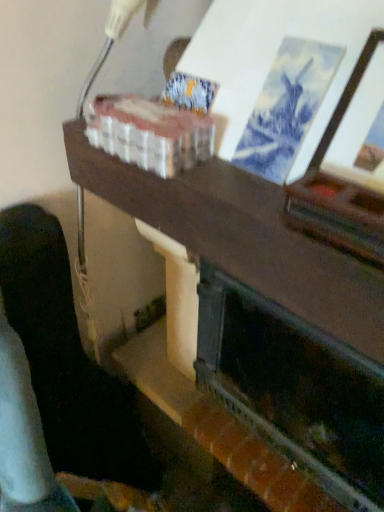
Question: Is the surface of dark wood shelf at lower left in direct contact with dark green painted wood fireplace at center?

Choices:
 (A) no
 (B) yes

Answer: (A)

Question: From a real-world perspective, is dark wood shelf at lower left on dark green painted wood fireplace at center?

Choices:
 (A) no
 (B) yes

Answer: (A)

Question: Can we say dark wood shelf at lower left lies outside dark green painted wood fireplace at center?

Choices:
 (A) no
 (B) yes

Answer: (B)

Question: Does dark wood shelf at lower left contain dark green painted wood fireplace at center?

Choices:
 (A) yes
 (B) no

Answer: (B)

Question: Is dark wood shelf at lower left shorter than dark green painted wood fireplace at center?

Choices:
 (A) yes
 (B) no

Answer: (B)

Question: Is dark green painted wood fireplace at center spatially inside dark wood table at center, or outside of it?

Choices:
 (A) inside
 (B) outside

Answer: (A)

Question: Is point (208, 373) positioned closer to the camera than point (283, 346)?

Choices:
 (A) farther
 (B) closer

Answer: (A)

Question: In the image, is dark green painted wood fireplace at center positioned in front of or behind dark wood table at center?

Choices:
 (A) front
 (B) behind

Answer: (B)

Question: From a real-world perspective, is dark green painted wood fireplace at center positioned above or below dark wood table at center?

Choices:
 (A) above
 (B) below

Answer: (B)

Question: Considering the positions of point (16, 306) and point (206, 370), is point (16, 306) closer or farther from the camera than point (206, 370)?

Choices:
 (A) farther
 (B) closer

Answer: (B)

Question: Relative to dark green painted wood fireplace at center, is dark wood shelf at lower left in front or behind?

Choices:
 (A) front
 (B) behind

Answer: (B)

Question: Is dark wood shelf at lower left taller or shorter than dark green painted wood fireplace at center?

Choices:
 (A) short
 (B) tall

Answer: (B)

Question: Is dark wood shelf at lower left inside or outside of dark green painted wood fireplace at center?

Choices:
 (A) outside
 (B) inside

Answer: (A)

Question: Is point (256, 220) closer or farther from the camera than point (6, 473)?

Choices:
 (A) farther
 (B) closer

Answer: (B)

Question: Is dark wood table at center in front of or behind dark wood shelf at lower left in the image?

Choices:
 (A) front
 (B) behind

Answer: (A)